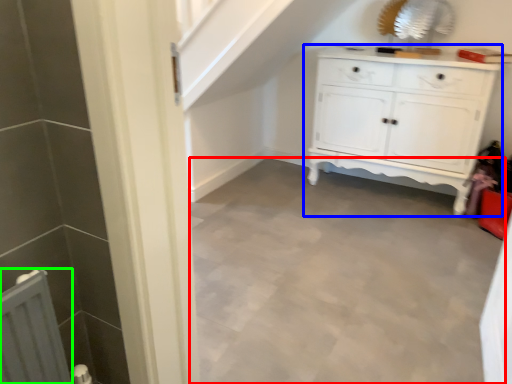
Question: Considering the real-world distances, which object is farthest from plain (highlighted by a red box)? chest of drawers (highlighted by a blue box) or radiator (highlighted by a green box)?

Choices:
 (A) chest of drawers
 (B) radiator

Answer: (B)